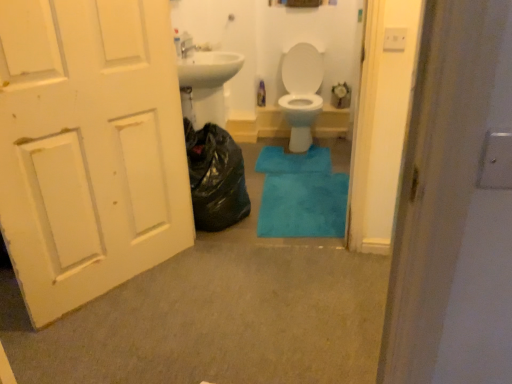
What do you see at coordinates (294, 161) in the screenshot? I see `blue plush bath mat at center, positioned as the second bath mat in front-to-back order` at bounding box center [294, 161].

What do you see at coordinates (89, 148) in the screenshot?
I see `white painted wood door at left` at bounding box center [89, 148].

This screenshot has width=512, height=384. I want to click on blue plush bath mat at center, positioned as the second bath mat in front-to-back order, so click(x=294, y=161).

Is blue plush bath mat at center, which is counted as the 2th bath mat, starting from the top, taller than blue plush bath mat at center, positioned as the second bath mat in front-to-back order?

No, blue plush bath mat at center, which is counted as the 2th bath mat, starting from the top, is not taller than blue plush bath mat at center, positioned as the second bath mat in front-to-back order.

From the image's perspective, which is above, blue plush bath mat at center, which is counted as the 2th bath mat, starting from the top, or blue plush bath mat at center, positioned as the second bath mat in front-to-back order?

From the image's view, blue plush bath mat at center, positioned as the second bath mat in front-to-back order, is above.

Which of these two, blue plush bath mat at center, arranged as the 1th bath mat when viewed from the front, or blue plush bath mat at center, positioned as the second bath mat in front-to-back order, is smaller?

blue plush bath mat at center, positioned as the second bath mat in front-to-back order.

Is blue plush bath mat at center, which is counted as the 2th bath mat, starting from the top, positioned far away from blue plush bath mat at center, which ranks as the first bath mat in top-to-bottom order?

No, blue plush bath mat at center, which is counted as the 2th bath mat, starting from the top, is in close proximity to blue plush bath mat at center, which ranks as the first bath mat in top-to-bottom order.

Is white painted wood door at left next to blue plush bath mat at center, which is the 2th bath mat in back-to-front order?

There is a gap between white painted wood door at left and blue plush bath mat at center, which is the 2th bath mat in back-to-front order.

Is white painted wood door at left facing towards blue plush bath mat at center, which is counted as the 2th bath mat, starting from the top?

No, white painted wood door at left does not turn towards blue plush bath mat at center, which is counted as the 2th bath mat, starting from the top.

Does white painted wood door at left come behind blue plush bath mat at center, which is the 2th bath mat in back-to-front order?

That is False.

Could you measure the distance between white painted wood door at left and blue plush bath mat at center, the 1th bath mat when ordered from bottom to top?

37.75 inches.

Are black plastic bag at left and white painted wood door at left far apart?

black plastic bag at left is actually quite close to white painted wood door at left.

The height and width of the screenshot is (384, 512). In the image, there is a black plastic bag at left. In order to click on door below it (from the image's perspective) in this screenshot , I will do `click(89, 148)`.

Looking at their sizes, would you say black plastic bag at left is wider or thinner than white painted wood door at left?

Considering their sizes, black plastic bag at left looks broader than white painted wood door at left.

Do you think blue plush bath mat at center, which is counted as the 2th bath mat, starting from the top, is within black plastic bag at left, or outside of it?

blue plush bath mat at center, which is counted as the 2th bath mat, starting from the top, is not inside black plastic bag at left, it's outside.

Considering the relative positions of blue plush bath mat at center, arranged as the 1th bath mat when viewed from the front, and black plastic bag at left in the image provided, is blue plush bath mat at center, arranged as the 1th bath mat when viewed from the front, to the right of black plastic bag at left from the viewer's perspective?

Correct, you'll find blue plush bath mat at center, arranged as the 1th bath mat when viewed from the front, to the right of black plastic bag at left.

Consider the image. Considering the positions of objects blue plush bath mat at center, positioned as the second bath mat in front-to-back order, and white glossy toilet at center in the image provided, who is more to the left, blue plush bath mat at center, positioned as the second bath mat in front-to-back order, or white glossy toilet at center?

From the viewer's perspective, blue plush bath mat at center, positioned as the second bath mat in front-to-back order, appears more on the left side.

Between point (305, 157) and point (316, 74), which one is positioned in front?

The point (305, 157) is more forward.

At what (x,y) coordinates should I click in order to perform the action: click on bath mat lying behind the white glossy toilet at center. Please return your answer as a coordinate pair (x, y). The width and height of the screenshot is (512, 384). Looking at the image, I should click on (294, 161).

From a real-world perspective, is blue plush bath mat at center, which ranks as the first bath mat in top-to-bottom order, on top of white glossy toilet at center?

Incorrect, from a real-world perspective, blue plush bath mat at center, which ranks as the first bath mat in top-to-bottom order, is lower than white glossy toilet at center.

Does white painted wood door at left contain black plastic bag at left?

No, black plastic bag at left is not inside white painted wood door at left.

Does white painted wood door at left turn towards black plastic bag at left?

No, white painted wood door at left is not facing towards black plastic bag at left.

Which is more to the right, white painted wood door at left or black plastic bag at left?

black plastic bag at left is more to the right.

The width and height of the screenshot is (512, 384). In order to click on garbage on the right of white painted wood door at left in this screenshot , I will do `click(215, 177)`.

What's the angular difference between blue plush bath mat at center, the second bath mat positioned from the bottom, and blue plush bath mat at center, which is counted as the 2th bath mat, starting from the top,'s facing directions?

The angle between the facing direction of blue plush bath mat at center, the second bath mat positioned from the bottom, and the facing direction of blue plush bath mat at center, which is counted as the 2th bath mat, starting from the top, is 3 degrees.

Find the location of a particular element. This screenshot has width=512, height=384. bath mat behind the blue plush bath mat at center, which is the 2th bath mat in back-to-front order is located at coordinates (294, 161).

Who is more distant, blue plush bath mat at center, the 1th bath mat positioned from the back, or blue plush bath mat at center, which is counted as the 2th bath mat, starting from the top?

Positioned behind is blue plush bath mat at center, the 1th bath mat positioned from the back.

From the image's perspective, which one is positioned higher, blue plush bath mat at center, the second bath mat positioned from the bottom, or blue plush bath mat at center, arranged as the 1th bath mat when viewed from the front?

blue plush bath mat at center, the second bath mat positioned from the bottom, is shown above in the image.

The height and width of the screenshot is (384, 512). What are the coordinates of `bath mat located on the right of blue plush bath mat at center, which ranks as the first bath mat in top-to-bottom order` in the screenshot? It's located at (301, 194).

Identify the location of bath mat located below the white painted wood door at left (from the image's perspective). (301, 194).

Which object lies nearer to the anchor point white glossy toilet at center, black plastic bag at left or blue plush bath mat at center, which is counted as the 2th bath mat, starting from the top?

blue plush bath mat at center, which is counted as the 2th bath mat, starting from the top, is positioned closer to the anchor white glossy toilet at center.

Estimate the real-world distances between objects in this image. Which object is further from blue plush bath mat at center, which ranks as the first bath mat in top-to-bottom order, black plastic bag at left or white glossy toilet at center?

Based on the image, black plastic bag at left appears to be further to blue plush bath mat at center, which ranks as the first bath mat in top-to-bottom order.

When comparing their distances from blue plush bath mat at center, the 1th bath mat when ordered from bottom to top, does white painted wood door at left or blue plush bath mat at center, positioned as the second bath mat in front-to-back order, seem closer?

blue plush bath mat at center, positioned as the second bath mat in front-to-back order, is positioned closer to the anchor blue plush bath mat at center, the 1th bath mat when ordered from bottom to top.

When comparing their distances from black plastic bag at left, does white glossy toilet at center or white painted wood door at left seem closer?

white painted wood door at left is positioned closer to the anchor black plastic bag at left.

From the picture: Based on their spatial positions, is blue plush bath mat at center, which ranks as the first bath mat in top-to-bottom order, or white painted wood door at left closer to black plastic bag at left?

white painted wood door at left.

Consider the image. Which object lies further to the anchor point white glossy toilet at center, blue plush bath mat at center, positioned as the second bath mat in front-to-back order, or black plastic bag at left?

black plastic bag at left is positioned further to the anchor white glossy toilet at center.

In the scene shown: Estimate the real-world distances between objects in this image. Which object is further from black plastic bag at left, white painted wood door at left or blue plush bath mat at center, which is the 2th bath mat in back-to-front order?

white painted wood door at left.

Considering their positions, is blue plush bath mat at center, which is counted as the 2th bath mat, starting from the top, positioned further to white glossy toilet at center than white painted wood door at left?

white painted wood door at left lies further to white glossy toilet at center than the other object.

Where is `bath mat between black plastic bag at left and white glossy toilet at center along the z-axis`? Image resolution: width=512 pixels, height=384 pixels. bath mat between black plastic bag at left and white glossy toilet at center along the z-axis is located at coordinates (301, 194).

Locate an element on the screen. toilet positioned between blue plush bath mat at center, which is counted as the 2th bath mat, starting from the top, and blue plush bath mat at center, the second bath mat positioned from the bottom, from near to far is located at coordinates (301, 93).

The image size is (512, 384). What are the coordinates of `bath mat positioned between white painted wood door at left and white glossy toilet at center from near to far` in the screenshot? It's located at (301, 194).

Find the location of a particular element. Image resolution: width=512 pixels, height=384 pixels. bath mat between white painted wood door at left and blue plush bath mat at center, positioned as the second bath mat in front-to-back order, along the z-axis is located at coordinates (301, 194).